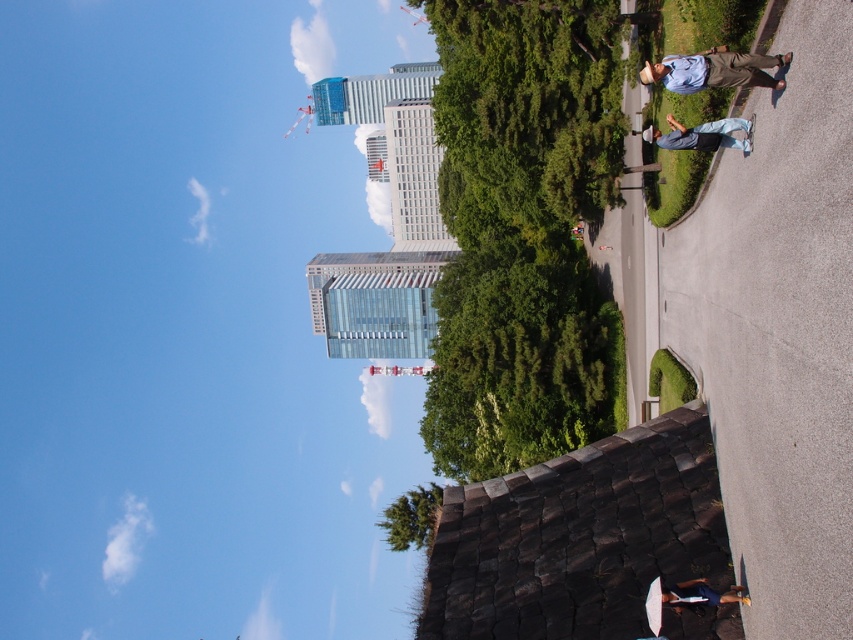
You are a landscape architect designing a new park. You have two green leafy trees to place in the park layout. The first is the green leafy tree at center and the second is the green leafy tree at lower center. Which tree should you place closer to the park entrance if you want the taller tree to be visible from the entrance?

You should place the green leafy tree at lower center closer to the park entrance because it is taller than the green leafy tree at center, ensuring the taller tree is visible from the entrance.